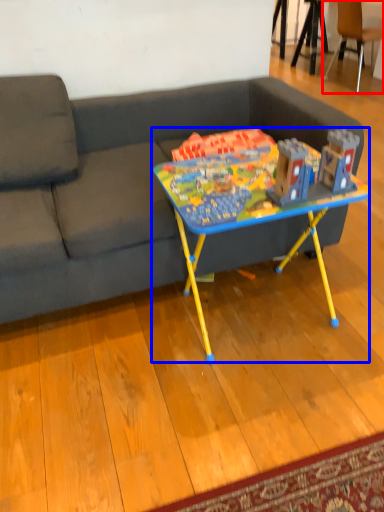
Question: Which object is closer to the camera taking this photo, chair (highlighted by a red box) or table (highlighted by a blue box)?

Choices:
 (A) chair
 (B) table

Answer: (B)